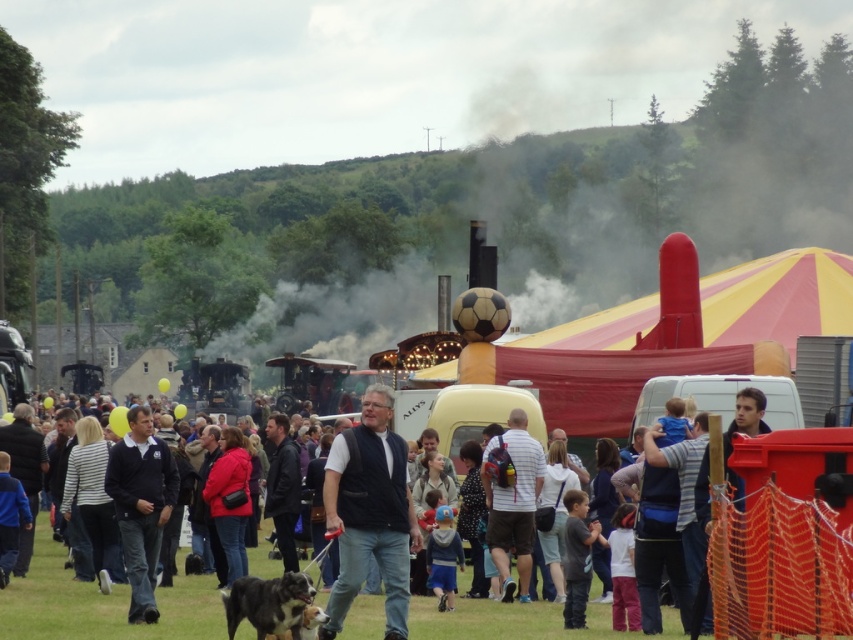
You are standing in the crowd at the fair and want to find the person wearing dark blue jeans at center. Which direction should you look relative to the person wearing white striped shirt at center?

The dark blue jeans at center is in front of the white striped shirt at center, so you should look forward towards the direction where the white striped shirt at center is located.

You are standing at the center of the fairground and see the point marked at coordinates (369, 513). What object is located at that point?

The point at coordinates (369, 513) corresponds to dark blue jeans at center.